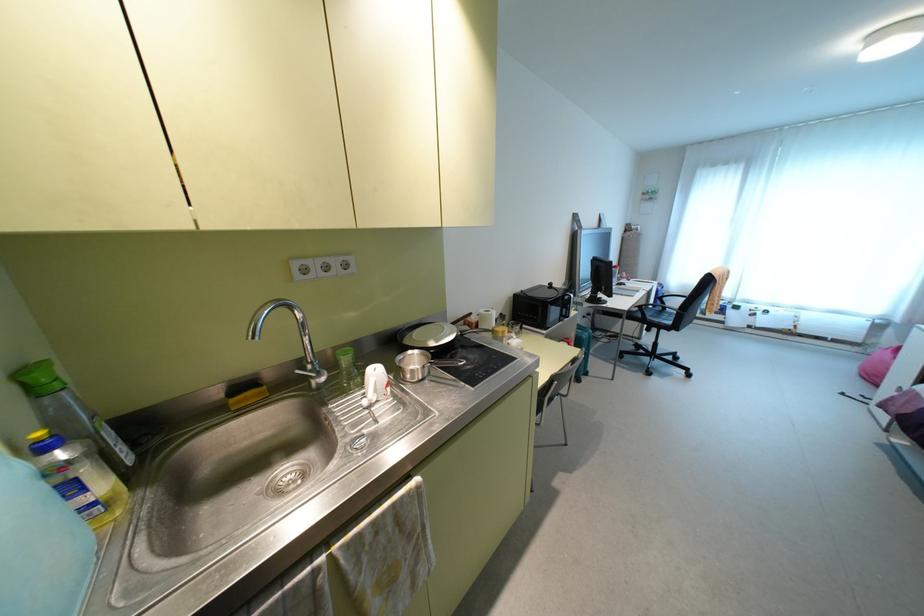
Identify the location of chair armrest. This screenshot has width=924, height=616. (669, 302).